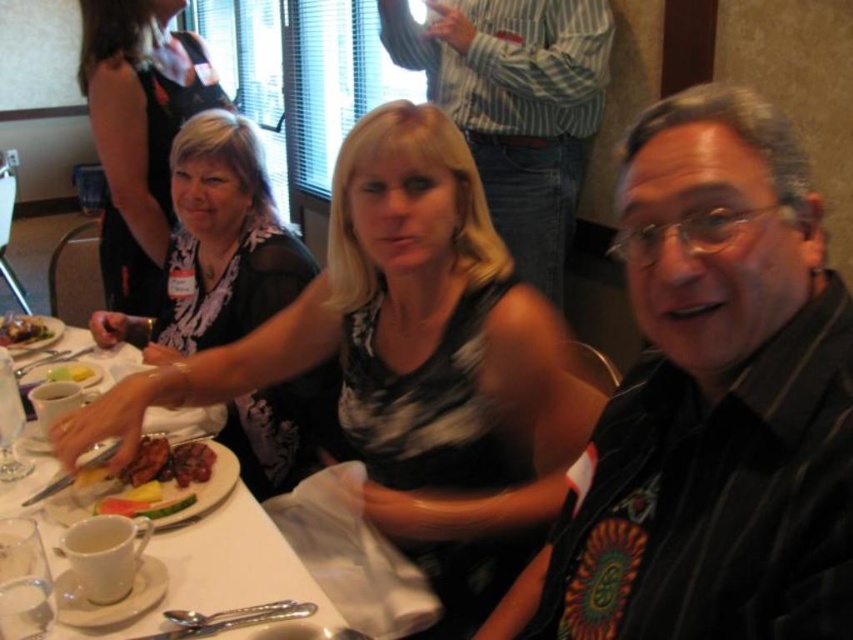
You are a waiter at this restaurant and need to place a dessert plate between the black lace dress at upper center and the brown glossy steak at center. Which object should you position the dessert plate closer to if the steak requires more space?

The brown glossy steak at center requires more space, so the dessert plate should be placed closer to the black lace dress at upper center to accommodate the steak.

You are a waiter in a restaurant and need to deliver a dessert to the table. The dessert needs to be placed between the black mesh dress at upper left and the brown glossy steak at center. Can you determine where to place the dessert?

The black mesh dress at upper left is to the right of the brown glossy steak at center, so the dessert should be placed between them by positioning it to the left of the black mesh dress at upper left and to the right of the brown glossy steak at center.